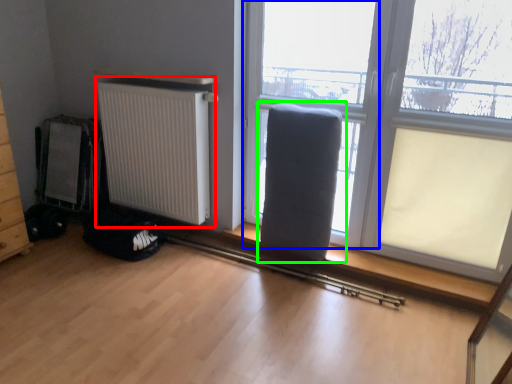
Question: Estimate the real-world distances between objects in this image. Which object is farther from radiator (highlighted by a red box), window frame (highlighted by a blue box) or armchair (highlighted by a green box)?

Choices:
 (A) window frame
 (B) armchair

Answer: (B)